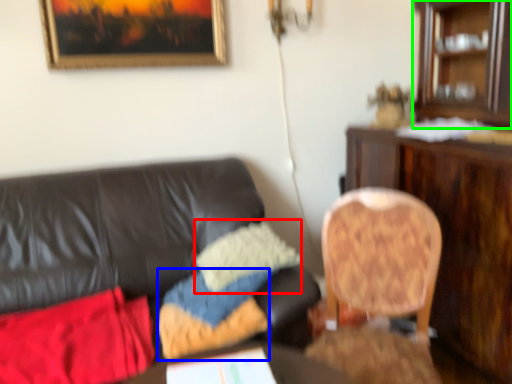
Question: Which object is the farthest from pillow (highlighted by a red box)? Choose among these: pillow (highlighted by a blue box) or cabinetry (highlighted by a green box).

Choices:
 (A) pillow
 (B) cabinetry

Answer: (B)